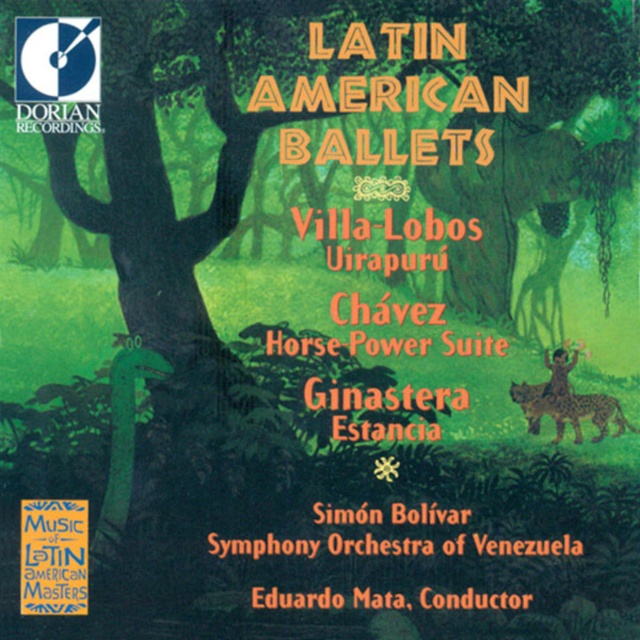
Based on the album cover for Latin American Ballets, which of the two points, point 1 at coordinates (557, 429) or point 2 at (550, 372), is closer to the viewer?

Point 1 at coordinates (557, 429) is closer to the viewer than point 2 at (550, 372).

You are an art curator examining the album cover for positioning adjustments. The spotted fur hyena at center and the brown fur jaguar at upper right need to be moved closer to the bottom edge of the image. Which animal should you move first to ensure both are positioned correctly without overlapping?

You should move the brown fur jaguar at upper right first because it is currently above the spotted fur hyena at center. Lowering it first ensures there is space to position both animals closer to the bottom edge without overlapping.